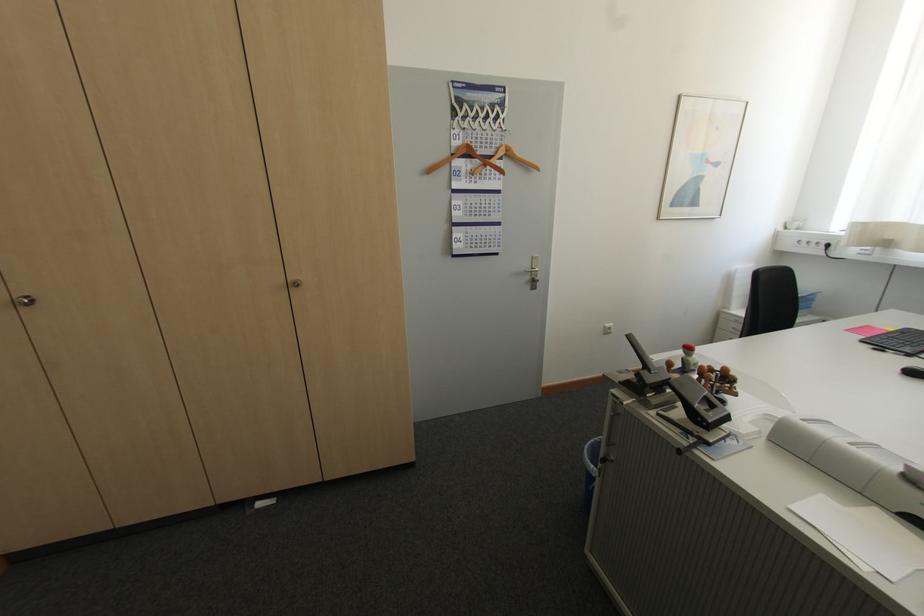
In order to click on black computer mouse in this screenshot , I will do 912,371.